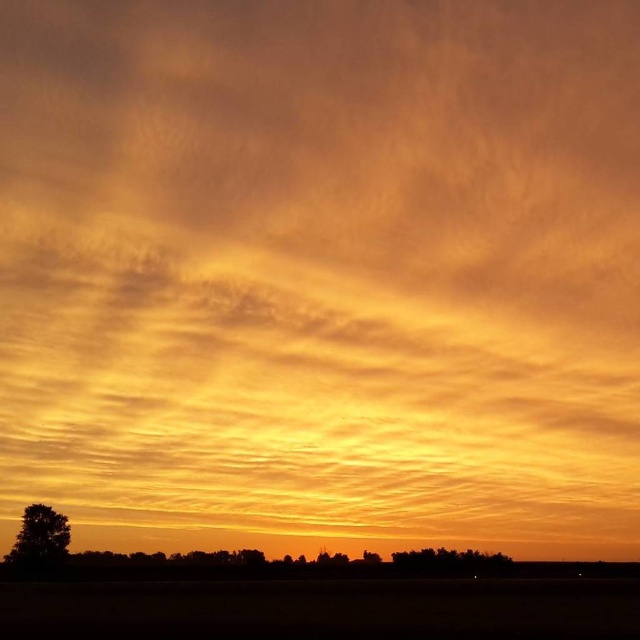
You are standing at the base of the silhouette tree at lower left and want to walk to the horizon line. How far will you have to walk?

The silhouette tree at lower left is 68.48 meters away from the horizon line, so you will have to walk 68.48 meters.